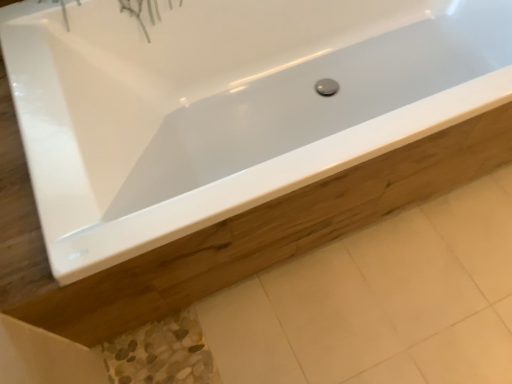
What do you see at coordinates (214, 108) in the screenshot? I see `white glossy bathtub at center` at bounding box center [214, 108].

What is the approximate height of white glossy bathtub at center?

white glossy bathtub at center is 23.19 inches in height.

In order to face white glossy bathtub at center, should I rotate leftwards or rightwards?

To align with it, rotate right about 12.921°.

Measure the distance between white glossy bathtub at center and camera.

29.74 inches.

Image resolution: width=512 pixels, height=384 pixels. I want to click on white glossy bathtub at center, so click(x=214, y=108).

You are a GUI agent. You are given a task and a screenshot of the screen. Output one action in this format:
    pyautogui.click(x=<x>, y=<y>)
    Task: Click on the white glossy bathtub at center
    The image size is (512, 384).
    Given the screenshot: What is the action you would take?
    pyautogui.click(x=214, y=108)